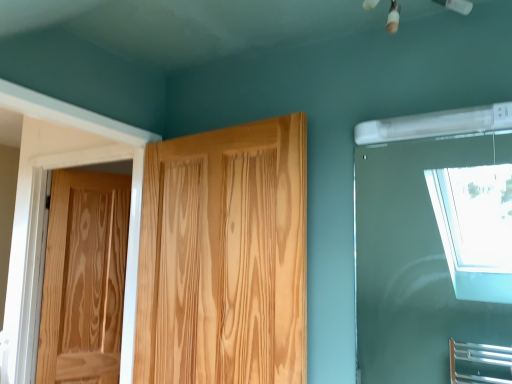
Question: Is transparent glass window at upper right positioned far away from natural wood door at left, placed as the first door when sorted from left to right?

Choices:
 (A) no
 (B) yes

Answer: (B)

Question: Considering the relative sizes of transparent glass window at upper right and natural wood door at left, placed as the first door when sorted from left to right, in the image provided, is transparent glass window at upper right bigger than natural wood door at left, placed as the first door when sorted from left to right,?

Choices:
 (A) yes
 (B) no

Answer: (B)

Question: Is transparent glass window at upper right touching natural wood door at left, placed as the first door when sorted from back to front?

Choices:
 (A) yes
 (B) no

Answer: (B)

Question: Is transparent glass window at upper right to the left of natural wood door at left, the second door positioned from the right, from the viewer's perspective?

Choices:
 (A) no
 (B) yes

Answer: (A)

Question: Does transparent glass window at upper right have a greater height compared to natural wood door at left, placed as the first door when sorted from left to right?

Choices:
 (A) no
 (B) yes

Answer: (A)

Question: From a real-world perspective, is transparent glass window at upper right positioned over natural wood door at left, placed as the first door when sorted from left to right, based on gravity?

Choices:
 (A) no
 (B) yes

Answer: (B)

Question: Can natural wood door at center, the second door viewed from the left, be found inside natural wood door at left, which is the 2th door in front-to-back order?

Choices:
 (A) no
 (B) yes

Answer: (A)

Question: Does natural wood door at left, the second door positioned from the right, come in front of natural wood door at center, the second door viewed from the left?

Choices:
 (A) no
 (B) yes

Answer: (A)

Question: Considering the relative sizes of natural wood door at left, which is the 2th door in front-to-back order, and natural wood door at center, the second door viewed from the left, in the image provided, is natural wood door at left, which is the 2th door in front-to-back order, bigger than natural wood door at center, the second door viewed from the left,?

Choices:
 (A) no
 (B) yes

Answer: (A)

Question: From a real-world perspective, is natural wood door at left, which is the 2th door in front-to-back order, physically below natural wood door at center, arranged as the second door when viewed from the back?

Choices:
 (A) yes
 (B) no

Answer: (A)

Question: Is natural wood door at left, which is the 2th door in front-to-back order, further to the viewer compared to natural wood door at center, arranged as the second door when viewed from the back?

Choices:
 (A) yes
 (B) no

Answer: (A)

Question: Is natural wood door at left, placed as the first door when sorted from left to right, in contact with natural wood door at center, arranged as the second door when viewed from the back?

Choices:
 (A) no
 (B) yes

Answer: (A)

Question: Is natural wood door at center, arranged as the second door when viewed from the back, to the right of transparent glass window at upper right from the viewer's perspective?

Choices:
 (A) yes
 (B) no

Answer: (B)